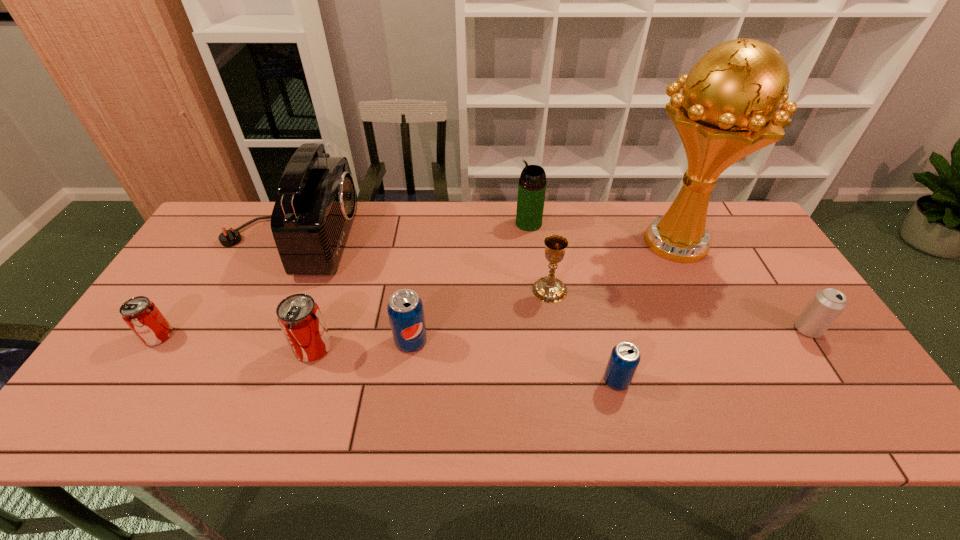
The width and height of the screenshot is (960, 540). Identify the location of radio receiver at the far edge. (313, 214).

Locate an element on the screen. The width and height of the screenshot is (960, 540). thermos bottle situated at the far edge is located at coordinates (532, 184).

At what (x,y) coordinates should I click in order to perform the action: click on radio receiver at the left edge. Please return your answer as a coordinate pair (x, y). The height and width of the screenshot is (540, 960). Looking at the image, I should click on (313, 214).

The width and height of the screenshot is (960, 540). I want to click on pop soda that is at the left edge, so click(x=143, y=317).

The height and width of the screenshot is (540, 960). Find the location of `trophy_cup present at the right edge`. trophy_cup present at the right edge is located at coordinates (727, 109).

Locate an element on the screen. The width and height of the screenshot is (960, 540). beer can present at the right edge is located at coordinates (826, 305).

In order to click on object that is at the far left corner in this screenshot , I will do `click(313, 214)`.

This screenshot has height=540, width=960. Identify the location of object located in the far right corner section of the desktop. (727, 109).

The width and height of the screenshot is (960, 540). I want to click on free space at the far edge of the desktop, so pyautogui.click(x=587, y=235).

Locate an element on the screen. This screenshot has width=960, height=540. free space at the near edge is located at coordinates click(804, 428).